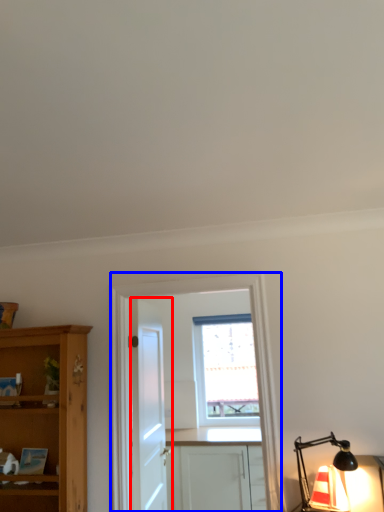
Question: Among these objects, which one is nearest to the camera, door (highlighted by a red box) or entertainment center (highlighted by a blue box)?

Choices:
 (A) door
 (B) entertainment center

Answer: (B)